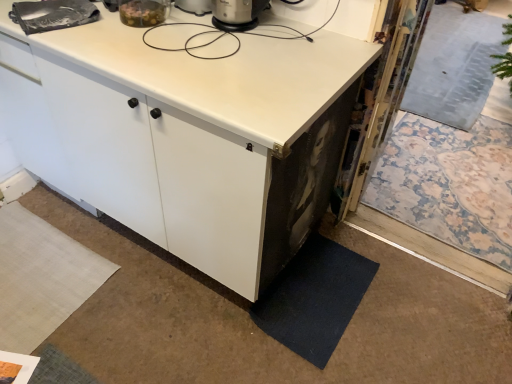
The image size is (512, 384). What do you see at coordinates (314, 298) in the screenshot?
I see `dark blue carpet at lower right` at bounding box center [314, 298].

What is the approximate height of white matte countertop at upper center?

10.48 inches.

Locate an element on the screen. Image resolution: width=512 pixels, height=384 pixels. white matte cabinet at center is located at coordinates (188, 135).

From the picture: Does dark blue carpet at lower right have a lesser height compared to white matte cabinet at center?

Correct, dark blue carpet at lower right is not as tall as white matte cabinet at center.

Which of these two, dark blue carpet at lower right or white matte cabinet at center, is smaller?

Smaller between the two is dark blue carpet at lower right.

Looking at this image, is dark blue carpet at lower right facing away from white matte cabinet at center?

dark blue carpet at lower right is not turned away from white matte cabinet at center.

Choose the correct answer: Is dark blue carpet at lower right inside white matte cabinet at center or outside it?

dark blue carpet at lower right exists outside the volume of white matte cabinet at center.

From a real-world perspective, is white matte cabinet at center physically located above or below dark blue carpet at lower right?

From a real-world perspective, white matte cabinet at center is physically above dark blue carpet at lower right.

Do you think white matte cabinet at center is within dark blue carpet at lower right, or outside of it?

white matte cabinet at center is not enclosed by dark blue carpet at lower right.

Considering the sizes of white matte cabinet at center and dark blue carpet at lower right in the image, is white matte cabinet at center taller or shorter than dark blue carpet at lower right?

Clearly, white matte cabinet at center is taller compared to dark blue carpet at lower right.

Considering the positions of objects white matte cabinet at center and dark blue carpet at lower right in the image provided, who is more to the right, white matte cabinet at center or dark blue carpet at lower right?

Positioned to the right is dark blue carpet at lower right.

Identify the location of countertop lying in front of the dark blue carpet at lower right. pos(218,74).

Is white matte countertop at upper center to the left of dark blue carpet at lower right from the viewer's perspective?

Indeed, white matte countertop at upper center is positioned on the left side of dark blue carpet at lower right.

Is white matte countertop at upper center taller or shorter than dark blue carpet at lower right?

In the image, white matte countertop at upper center appears to be taller than dark blue carpet at lower right.

Is dark blue carpet at lower right facing towards white matte countertop at upper center?

No.

From the image's perspective, would you say dark blue carpet at lower right is positioned over white matte countertop at upper center?

No, from the image's perspective, dark blue carpet at lower right is not over white matte countertop at upper center.

Is dark blue carpet at lower right completely or partially outside of white matte countertop at upper center?

dark blue carpet at lower right is positioned outside white matte countertop at upper center.

Measure the distance from white matte countertop at upper center to white matte cabinet at center.

white matte countertop at upper center is 6.01 inches from white matte cabinet at center.

Is white matte countertop at upper center outside of white matte cabinet at center?

white matte countertop at upper center lies outside white matte cabinet at center's area.

Between white matte countertop at upper center and white matte cabinet at center, which one has larger width?

Wider between the two is white matte countertop at upper center.

Considering the positions of objects white matte countertop at upper center and white matte cabinet at center in the image provided, who is more to the left, white matte countertop at upper center or white matte cabinet at center?

From the viewer's perspective, white matte cabinet at center appears more on the left side.

Locate an element on the screen. This screenshot has width=512, height=384. cabinetry above the white matte countertop at upper center (from the image's perspective) is located at coordinates (188, 135).

Between white matte cabinet at center and white matte countertop at upper center, which one is positioned in front?

white matte countertop at upper center is more forward.

From the picture: Are white matte cabinet at center and white matte countertop at upper center located far from each other?

white matte cabinet at center is near white matte countertop at upper center, not far away.

Image resolution: width=512 pixels, height=384 pixels. Identify the location of mat behind the white matte cabinet at center. (314, 298).

This screenshot has width=512, height=384. In order to click on cabinetry above the dark blue carpet at lower right (from the image's perspective) in this screenshot , I will do `click(188, 135)`.

Based on their spatial positions, is white matte cabinet at center or dark blue carpet at lower right closer to white matte countertop at upper center?

white matte cabinet at center.

Considering their positions, is white matte cabinet at center positioned further to dark blue carpet at lower right than white matte countertop at upper center?

white matte countertop at upper center is positioned further to the anchor dark blue carpet at lower right.

Estimate the real-world distances between objects in this image. Which object is closer to dark blue carpet at lower right, white matte countertop at upper center or white matte cabinet at center?

white matte cabinet at center.

Consider the image. Looking at the image, which one is located closer to white matte cabinet at center, white matte countertop at upper center or dark blue carpet at lower right?

white matte countertop at upper center.

Which object lies further to the anchor point white matte countertop at upper center, dark blue carpet at lower right or white matte cabinet at center?

dark blue carpet at lower right.

When comparing their distances from white matte cabinet at center, does dark blue carpet at lower right or white matte countertop at upper center seem further?

The object further to white matte cabinet at center is dark blue carpet at lower right.

Find the location of `countertop between white matte cabinet at center and dark blue carpet at lower right vertically`. countertop between white matte cabinet at center and dark blue carpet at lower right vertically is located at coordinates (218, 74).